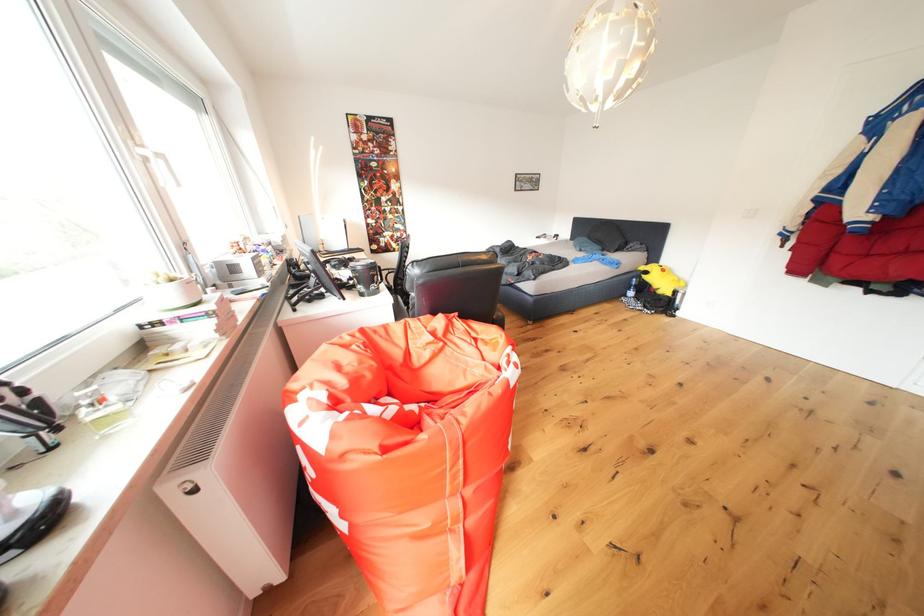
Identify the location of yellow stuffed toy. (662, 280).